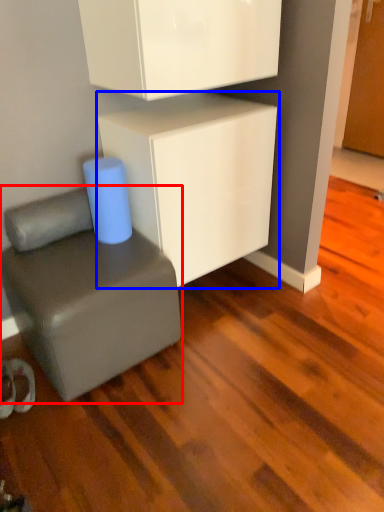
Question: Which object appears closest to the camera in this image, furniture (highlighted by a red box) or cabinetry (highlighted by a blue box)?

Choices:
 (A) furniture
 (B) cabinetry

Answer: (A)